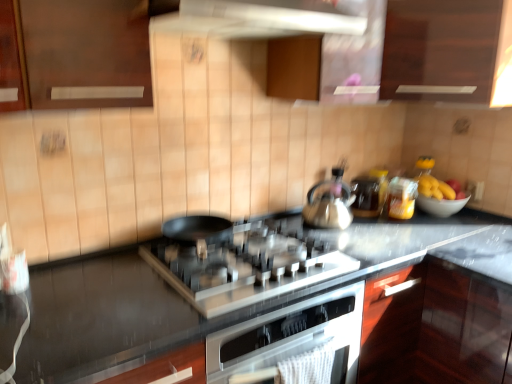
The height and width of the screenshot is (384, 512). I want to click on vacant area that lies between satin silver kettle at center and matte yellow jar at upper right, which is the first appliance in right-to-left order, so click(x=374, y=223).